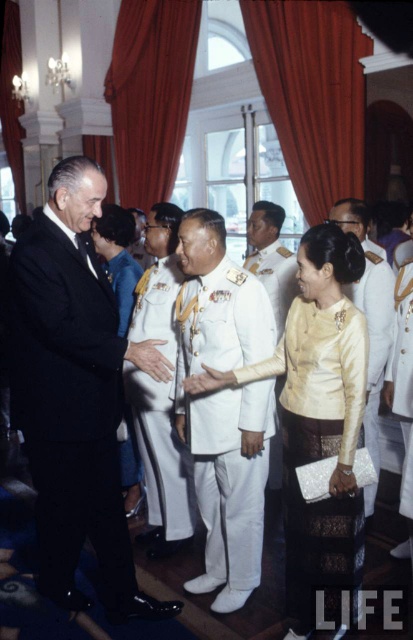
Which is more to the right, black suit at left or white satin uniform at center?

Positioned to the right is white satin uniform at center.

Can you confirm if black suit at left is wider than white satin uniform at center?

Correct, the width of black suit at left exceeds that of white satin uniform at center.

Between point (19, 349) and point (161, 397), which one is positioned behind?

Point (161, 397)

I want to click on black suit at left, so click(x=73, y=394).

Who is positioned more to the left, white uniform at center or white satin uniform at center?

From the viewer's perspective, white satin uniform at center appears more on the left side.

Is white uniform at center thinner than white satin uniform at center?

Incorrect, white uniform at center's width is not less than white satin uniform at center's.

Does point (177, 253) come closer to viewer compared to point (140, 419)?

Yes, it is in front of point (140, 419).

At what (x,y) coordinates should I click in order to perform the action: click on white uniform at center. Please return your answer as a coordinate pair (x, y). The image size is (413, 640). Looking at the image, I should click on (223, 406).

In the scene shown: Is black suit at left further to the viewer compared to white glossy uniform at center?

No, black suit at left is in front of white glossy uniform at center.

I want to click on black suit at left, so click(x=73, y=394).

Find the location of `black suit at left`. black suit at left is located at coordinates pyautogui.click(x=73, y=394).